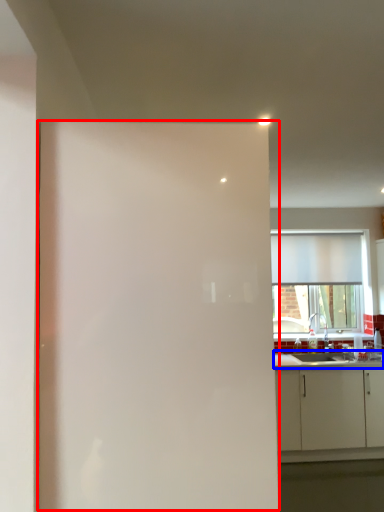
Question: Among these objects, which one is farthest to the camera, screen door (highlighted by a red box) or countertop (highlighted by a blue box)?

Choices:
 (A) screen door
 (B) countertop

Answer: (B)